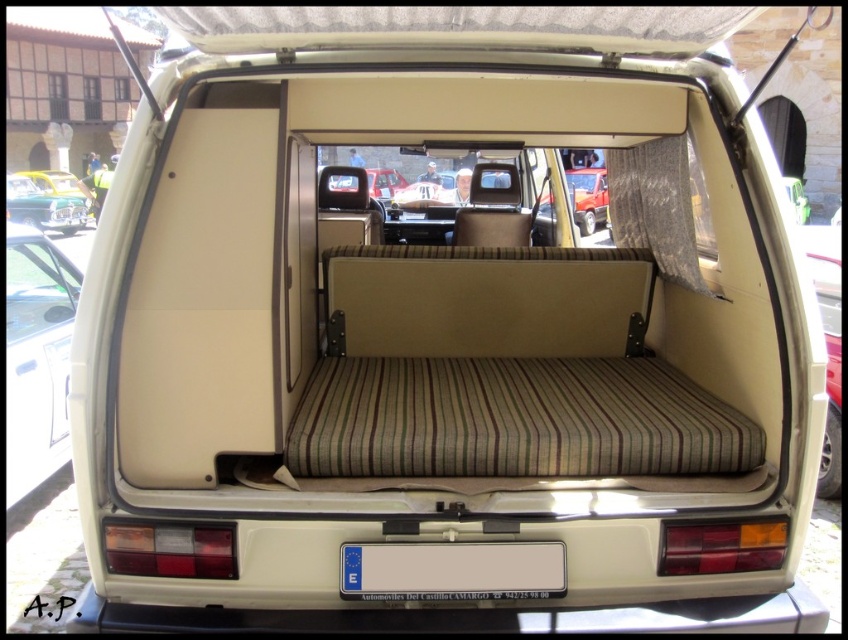
Question: Estimate the real-world distances between objects in this image. Which object is closer to the white plastic license plate at center?

Choices:
 (A) shiny green car at upper left
 (B) metallic silver car at center
 (C) white matte car at left

Answer: (C)

Question: Is white matte car at left bigger than metallic silver car at center?

Choices:
 (A) yes
 (B) no

Answer: (B)

Question: Which point appears farthest from the camera in this image?

Choices:
 (A) (361, 568)
 (B) (594, 220)
 (C) (31, 182)

Answer: (C)

Question: Does shiny green car at upper left have a smaller size compared to metallic silver car at center?

Choices:
 (A) yes
 (B) no

Answer: (A)

Question: Is white plastic license plate at center to the right of metallic silver car at center from the viewer's perspective?

Choices:
 (A) yes
 (B) no

Answer: (B)

Question: Among these objects, which one is farthest from the camera?

Choices:
 (A) white matte car at left
 (B) metallic silver car at center
 (C) shiny green car at upper left
 (D) white plastic license plate at center

Answer: (C)